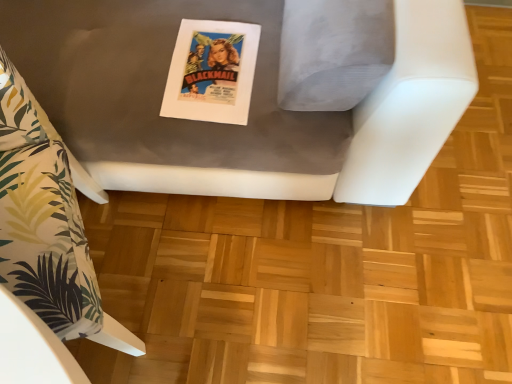
Question: In terms of size, does matte paper poster at center appear bigger or smaller than matte gray cushion at center, the 2th furniture in the left-to-right sequence?

Choices:
 (A) small
 (B) big

Answer: (A)

Question: Based on their positions, is matte paper poster at center located to the left or right of matte gray cushion at center, the 2th furniture in the left-to-right sequence?

Choices:
 (A) left
 (B) right

Answer: (B)

Question: Which is nearer to the matte gray cushion at center, which is counted as the 1th furniture, starting from the right?

Choices:
 (A) white fabric pillow at left, which is counted as the first furniture, starting from the left
 (B) matte paper poster at center

Answer: (B)

Question: Which of these objects is positioned farthest from the matte gray cushion at center, the 2th furniture in the left-to-right sequence?

Choices:
 (A) white fabric pillow at left, the second furniture from the right
 (B) matte paper poster at center

Answer: (A)